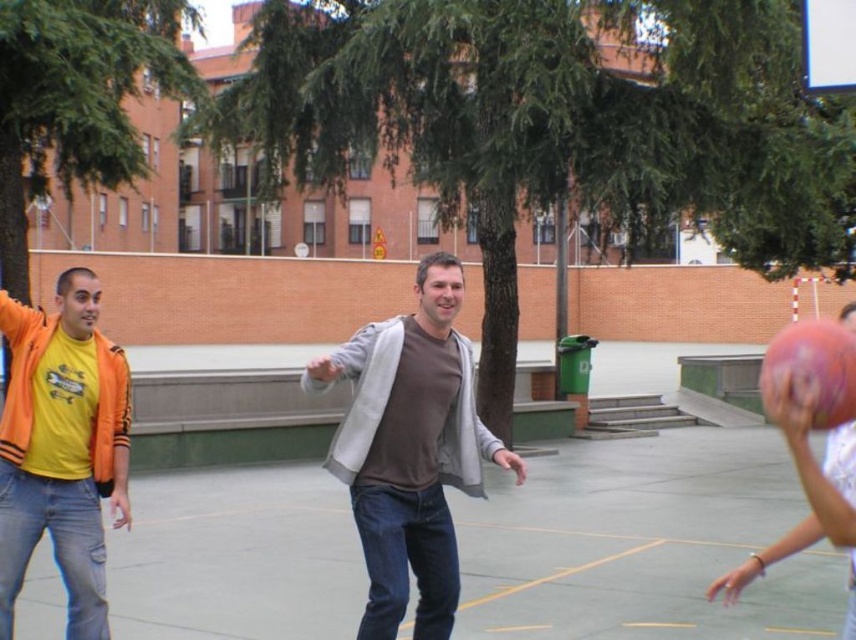
Between gray cotton sweater at center and rubber basketball at right, which one has more height?

Standing taller between the two is gray cotton sweater at center.

Does gray cotton sweater at center appear over rubber basketball at right?

No, gray cotton sweater at center is not above rubber basketball at right.

Locate an element on the screen. The image size is (856, 640). gray cotton sweater at center is located at coordinates tap(409, 449).

Based on the photo, does gray cotton sweater at center appear on the right side of matte orange jacket at left?

Yes, gray cotton sweater at center is to the right of matte orange jacket at left.

Can you confirm if gray cotton sweater at center is shorter than matte orange jacket at left?

Yes, gray cotton sweater at center is shorter than matte orange jacket at left.

This screenshot has width=856, height=640. In order to click on gray cotton sweater at center in this screenshot , I will do `click(409, 449)`.

Between gray cotton sweater at center and rubber textured basketball at right, which one is positioned higher?

rubber textured basketball at right is higher up.

Which is in front, point (383, 321) or point (823, 397)?

Point (823, 397) is in front.

Is point (401, 394) closer to camera compared to point (809, 353)?

No, it is behind (809, 353).

Where is `gray cotton sweater at center`? Image resolution: width=856 pixels, height=640 pixels. gray cotton sweater at center is located at coordinates (409, 449).